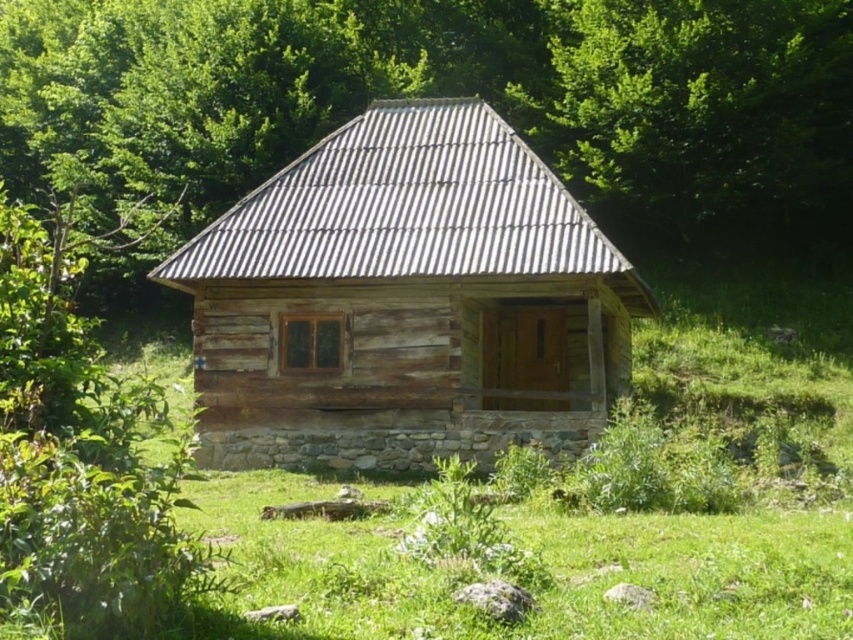
You are standing in front of the cabin and want to take a photo that includes both the green leafy tree at upper center and the weathered wood log cabin at center. Which object should you position closer to the edge of the frame to ensure both fit in the photo?

Since the green leafy tree at upper center is wider than the weathered wood log cabin at center, you should position the wider green leafy tree at upper center closer to the edge of the frame to ensure both fit in the photo.